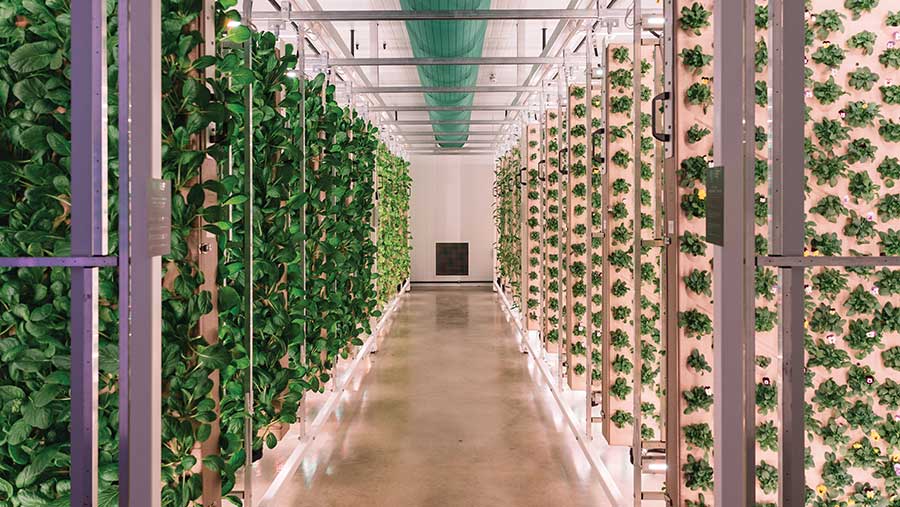
Identify the location of handle. (653, 112).